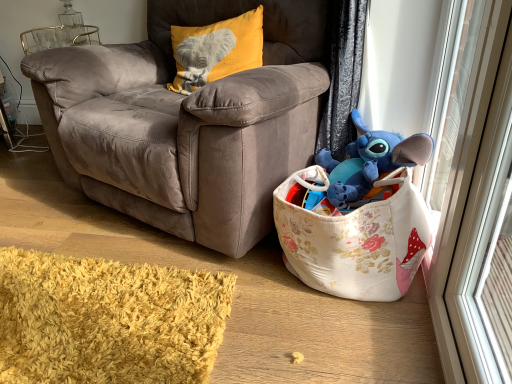
Question: In the image, is blue plush toy at upper right positioned in front of or behind transparent glass screen door at right?

Choices:
 (A) behind
 (B) front

Answer: (A)

Question: Would you say blue plush toy at upper right is to the left or to the right of transparent glass screen door at right in the picture?

Choices:
 (A) right
 (B) left

Answer: (B)

Question: Which object is the closest to the velvet brown armchair at center?

Choices:
 (A) blue plush toy at upper right
 (B) transparent glass screen door at right
 (C) velvet yellow pillow with elephant design at upper left
 (D) floral fabric toy basket at lower right

Answer: (C)

Question: Based on their relative distances, which object is nearer to the velvet brown armchair at center?

Choices:
 (A) velvet yellow pillow with elephant design at upper left
 (B) transparent glass screen door at right
 (C) blue plush toy at upper right
 (D) floral fabric toy basket at lower right

Answer: (A)